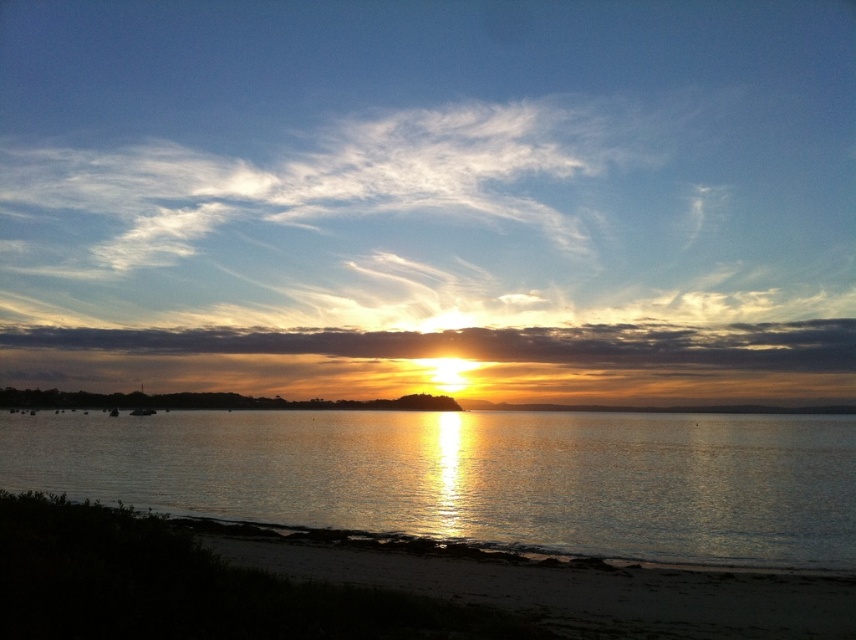
Does glistening water at center have a smaller size compared to sandy beach at lower left?

Actually, glistening water at center might be larger than sandy beach at lower left.

Does glistening water at center have a greater height compared to sandy beach at lower left?

Correct, glistening water at center is much taller as sandy beach at lower left.

Does point (354, 435) come farther from viewer compared to point (357, 621)?

Yes, point (354, 435) is behind point (357, 621).

Locate an element on the screen. glistening water at center is located at coordinates (474, 476).